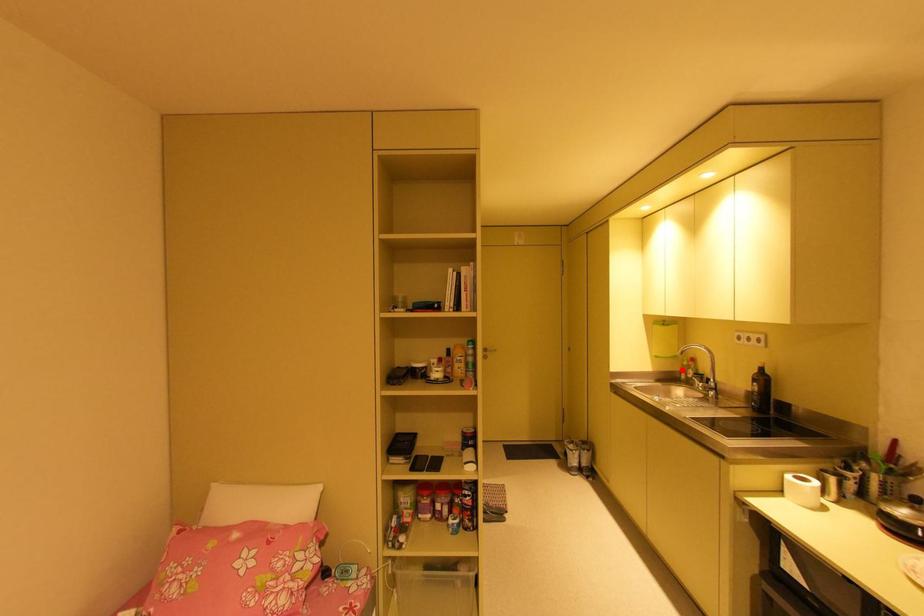
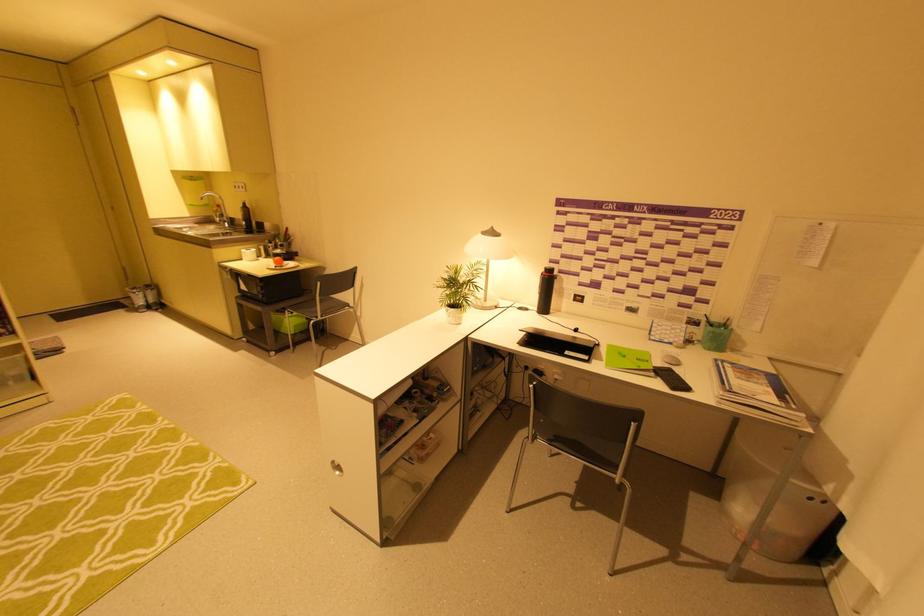
Where in the second image is the point corresponding to the highlighted location from the first image?

(215, 215)